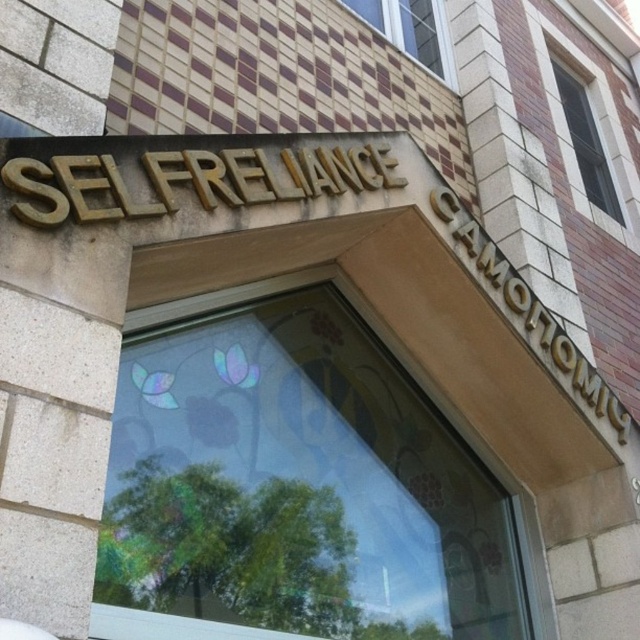
Which is above, transparent stained glass at center or clear glass window at upper right?

Positioned higher is clear glass window at upper right.

Is transparent stained glass at center to the left of clear glass window at upper right from the viewer's perspective?

Correct, you'll find transparent stained glass at center to the left of clear glass window at upper right.

Does point (470, 572) lie behind point (586, 189)?

No, (470, 572) is closer to viewer.

Where is `transparent stained glass at center`? The image size is (640, 640). transparent stained glass at center is located at coordinates (301, 484).

Is clear glass window at upper center closer to camera compared to clear glass window at upper right?

Yes.

Between clear glass window at upper center and clear glass window at upper right, which one appears on the right side from the viewer's perspective?

clear glass window at upper right

Which is behind, point (445, 72) or point (577, 120)?

The point (577, 120) is behind.

You are a GUI agent. You are given a task and a screenshot of the screen. Output one action in this format:
    pyautogui.click(x=<x>, y=<y>)
    Task: Click on the clear glass window at upper center
    Image resolution: width=640 pixels, height=640 pixels.
    Given the screenshot: What is the action you would take?
    pyautogui.click(x=412, y=29)

Who is higher up, transparent stained glass at center or clear glass window at upper center?

clear glass window at upper center is above.

Does point (324, 484) come behind point (419, 33)?

No, (324, 484) is closer to viewer.

Is point (221, 580) less distant than point (412, 17)?

That is True.

The height and width of the screenshot is (640, 640). Identify the location of transparent stained glass at center. (301, 484).